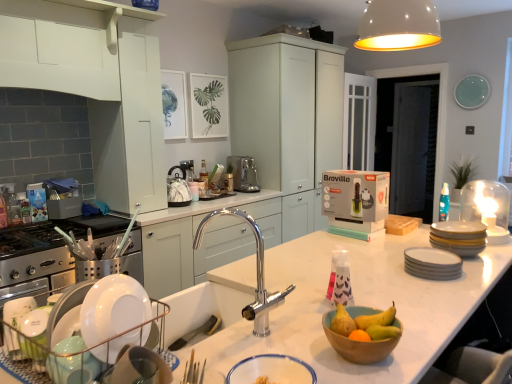
Image resolution: width=512 pixels, height=384 pixels. What do you see at coordinates (57, 49) in the screenshot? I see `white matte cabinet at upper left, which is counted as the first cabinetry, starting from the left` at bounding box center [57, 49].

This screenshot has height=384, width=512. Describe the element at coordinates (131, 126) in the screenshot. I see `white matte cabinet at upper left, the 2th cabinetry in the right-to-left sequence` at that location.

Where is `white matte cabinet at upper left, placed as the second cabinetry when sorted from front to back`? The image size is (512, 384). white matte cabinet at upper left, placed as the second cabinetry when sorted from front to back is located at coordinates (131, 126).

Describe the element at coordinates (342, 322) in the screenshot. I see `matte yellow pear at center, the 2th fruit from the right` at that location.

I want to click on white matte cabinet at upper left, the third cabinetry from the back, so click(57, 49).

Is the surface of wooden bowl at center, which ranks as the 1th basin in right-to-left order, in direct contact with translucent plastic bottle at left?

No, wooden bowl at center, which ranks as the 1th basin in right-to-left order, is not making contact with translucent plastic bottle at left.

Can you tell me how much wooden bowl at center, which is the first basin from back to front, and translucent plastic bottle at left differ in facing direction?

180 degrees separate the facing orientations of wooden bowl at center, which is the first basin from back to front, and translucent plastic bottle at left.

Is wooden bowl at center, which is the first basin from back to front, thinner than translucent plastic bottle at left?

Incorrect, the width of wooden bowl at center, which is the first basin from back to front, is not less than that of translucent plastic bottle at left.

Which is more to the left, wooden bowl at center, which ranks as the 1th basin in right-to-left order, or translucent plastic bottle at left?

translucent plastic bottle at left.

Based on their positions, is metallic silverware at lower center located to the left or right of white matte plates at right?

Clearly, metallic silverware at lower center is on the left of white matte plates at right in the image.

Between metallic silverware at lower center and white matte plates at right, which one is positioned in front?

metallic silverware at lower center is closer to the camera.

From a real-world perspective, which object rests below the other?

In real-world perspective, white matte plates at right is lower.

Locate an element on the screen. silverware lying on the left of white matte plates at right is located at coordinates (193, 371).

In terms of width, does metallic silverware at lower center look wider or thinner when compared to white matte light fixture at upper center?

Considering their sizes, metallic silverware at lower center looks slimmer than white matte light fixture at upper center.

Can you tell me how much metallic silverware at lower center and white matte light fixture at upper center differ in facing direction?

metallic silverware at lower center and white matte light fixture at upper center are facing 141 degrees away from each other.

From the image's perspective, is metallic silverware at lower center above or below white matte light fixture at upper center?

Clearly, from the image's perspective, metallic silverware at lower center is below white matte light fixture at upper center.

From a real-world perspective, is metallic silverware at lower center under white matte light fixture at upper center?

Yes, from a real-world perspective, metallic silverware at lower center is under white matte light fixture at upper center.

Find the location of a particular element. The width and height of the screenshot is (512, 384). light fixture that is above the satin nickel coffee maker at center (from a real-world perspective) is located at coordinates (398, 25).

From the image's perspective, is white matte light fixture at upper center above satin nickel coffee maker at center?

Yes, from the image's perspective, white matte light fixture at upper center is on top of satin nickel coffee maker at center.

Is white matte light fixture at upper center to the left or to the right of satin nickel coffee maker at center in the image?

Based on their positions, white matte light fixture at upper center is located to the right of satin nickel coffee maker at center.

Is point (386, 29) more distant than point (233, 164)?

No, (386, 29) is in front of (233, 164).

Considering the sizes of objects satin nickel coffee maker at center and metallic silverware at lower center in the image provided, who is taller, satin nickel coffee maker at center or metallic silverware at lower center?

satin nickel coffee maker at center is taller.

From a real-world perspective, who is located lower, satin nickel coffee maker at center or metallic silverware at lower center?

From a 3D spatial view, metallic silverware at lower center is below.

Find the location of a particular element. silverware below the satin nickel coffee maker at center (from the image's perspective) is located at coordinates (193, 371).

How different are the orientations of satin nickel coffee maker at center and metallic silverware at lower center in degrees?

52 degrees.

Is point (228, 167) positioned after point (370, 10)?

Yes, point (228, 167) is behind point (370, 10).

At what (x,y) coordinates should I click in order to perform the action: click on light fixture that is on the right side of satin nickel coffee maker at center. Please return your answer as a coordinate pair (x, y). The height and width of the screenshot is (384, 512). Looking at the image, I should click on (398, 25).

Can you confirm if satin nickel coffee maker at center is bigger than white matte light fixture at upper center?

Actually, satin nickel coffee maker at center might be smaller than white matte light fixture at upper center.

From a real-world perspective, is satin nickel coffee maker at center positioned above or below white matte light fixture at upper center?

satin nickel coffee maker at center is situated lower than white matte light fixture at upper center in the real world.

Which of these two, smooth wooden bowl at center, the 2th fruit in the left-to-right sequence, or white matte light fixture at upper center, is bigger?

white matte light fixture at upper center is bigger.

In the scene shown: Is the depth of smooth wooden bowl at center, the 2th fruit in the left-to-right sequence, greater than that of white matte light fixture at upper center?

That is False.

Considering the sizes of objects smooth wooden bowl at center, placed as the first fruit when sorted from right to left, and white matte light fixture at upper center in the image provided, who is taller, smooth wooden bowl at center, placed as the first fruit when sorted from right to left, or white matte light fixture at upper center?

Standing taller between the two is white matte light fixture at upper center.

The width and height of the screenshot is (512, 384). What are the coordinates of `light fixture on the right of the smooth wooden bowl at center, placed as the first fruit when sorted from right to left` in the screenshot? It's located at (398, 25).

This screenshot has height=384, width=512. Identify the location of the 2nd basin below the translucent plastic bottle at left (from a real-world perspective). (357, 345).

This screenshot has width=512, height=384. I want to click on tableware located on the right of metallic silverware at lower center, so click(432, 264).

Based on the photo, based on their spatial positions, is matte white cabinets at center, which is counted as the 3th cabinetry, starting from the left, or smooth wooden bowl at center, placed as the first fruit when sorted from right to left, further from translucent plastic bottle at left?

smooth wooden bowl at center, placed as the first fruit when sorted from right to left, is positioned further to the anchor translucent plastic bottle at left.

Looking at the image, which one is located closer to white glossy bowl at lower center, placed as the second basin when sorted from back to front, matte yellow pear at center, which ranks as the first fruit in left-to-right order, or stainless steel gas stove at left?

Among the two, matte yellow pear at center, which ranks as the first fruit in left-to-right order, is located nearer to white glossy bowl at lower center, placed as the second basin when sorted from back to front.

Considering their positions, is white glossy bowl at lower center, placed as the second basin when sorted from back to front, positioned closer to matte yellow pear at center, which ranks as the first fruit in left-to-right order, than satin nickel coffee maker at center?

Among the two, white glossy bowl at lower center, placed as the second basin when sorted from back to front, is located nearer to matte yellow pear at center, which ranks as the first fruit in left-to-right order.

Looking at this image, when comparing their distances from satin nickel coffee maker at center, does white matte plates at right or matte white cabinets at center, which is the third cabinetry from front to back, seem closer?

Based on the image, matte white cabinets at center, which is the third cabinetry from front to back, appears to be nearer to satin nickel coffee maker at center.

From the image, which object appears to be nearer to smooth wooden bowl at center, placed as the first fruit when sorted from right to left, yellow matte plates at right, which is the second appliance in left-to-right order, or matte yellow pear at center, the 2th fruit from the right?

matte yellow pear at center, the 2th fruit from the right.

From the image, which object appears to be farther from smooth wooden bowl at center, the 2th fruit in the left-to-right sequence, translucent plastic bottle at left or metallic silverware at lower center?

The object further to smooth wooden bowl at center, the 2th fruit in the left-to-right sequence, is translucent plastic bottle at left.

Looking at the image, which one is located further to satin nickel coffee maker at center, matte yellow pear at center, which ranks as the first fruit in left-to-right order, or white matte plates at right?

matte yellow pear at center, which ranks as the first fruit in left-to-right order, is positioned further to the anchor satin nickel coffee maker at center.

Which object lies further to the anchor point yellow matte plates at right, which is the second appliance in left-to-right order, satin nickel coffee maker at center or matte yellow pear at center, the 2th fruit from the right?

satin nickel coffee maker at center is positioned further to the anchor yellow matte plates at right, which is the second appliance in left-to-right order.

Where is `tableware positioned between white ceramic dish rack at left, the second appliance viewed from the top, and satin nickel coffee maker at center from near to far`? The image size is (512, 384). tableware positioned between white ceramic dish rack at left, the second appliance viewed from the top, and satin nickel coffee maker at center from near to far is located at coordinates (432, 264).

The height and width of the screenshot is (384, 512). Find the location of `light fixture between white ceramic dish rack at left, the 1th appliance positioned from the bottom, and satin nickel coffee maker at center, along the z-axis`. light fixture between white ceramic dish rack at left, the 1th appliance positioned from the bottom, and satin nickel coffee maker at center, along the z-axis is located at coordinates (398, 25).

Identify the location of appliance between white matte light fixture at upper center and matte yellow pear at center, the 2th fruit from the right, from top to bottom. (459, 237).

The width and height of the screenshot is (512, 384). Identify the location of tableware located between metallic silverware at lower center and matte white cabinets at center, which is the third cabinetry from front to back, in the depth direction. (432, 264).